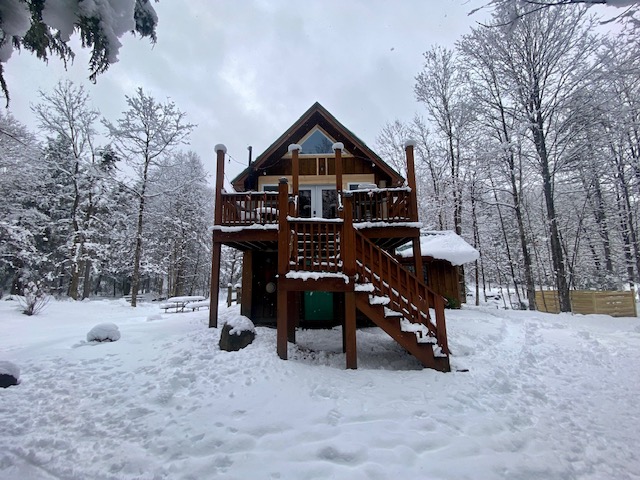
This screenshot has height=480, width=640. What are the coordinates of `window` in the screenshot? It's located at (314, 143).